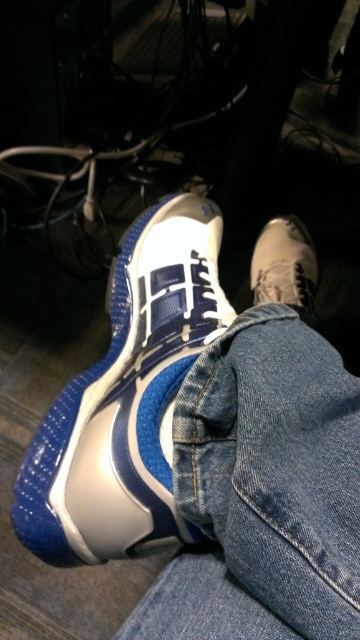
Looking at this image, is denim at lower left below blue rubber sneaker at lower left?

Yes.

Is denim at lower left wider than blue rubber sneaker at lower left?

No, denim at lower left is not wider than blue rubber sneaker at lower left.

Does point (345, 636) come in front of point (87, 403)?

Yes, point (345, 636) is in front of point (87, 403).

What are the coordinates of `denim at lower left` in the screenshot? It's located at tap(263, 490).

Does blue rubber sneaker at lower left appear on the left side of leather sneaker at lower right?

Yes, blue rubber sneaker at lower left is to the left of leather sneaker at lower right.

Locate an element on the screen. blue rubber sneaker at lower left is located at coordinates (127, 400).

You are a GUI agent. You are given a task and a screenshot of the screen. Output one action in this format:
    pyautogui.click(x=<x>, y=<y>)
    Task: Click on the blue rubber sneaker at lower left
    This screenshot has height=640, width=360.
    Given the screenshot: What is the action you would take?
    pos(127,400)

Is denim at lower left wider than leather sneaker at lower right?

Yes.

Is denim at lower left positioned at the back of leather sneaker at lower right?

No, denim at lower left is closer to the viewer.

Measure the distance between point (204, 416) and camera.

Point (204, 416) and camera are 14.45 inches apart from each other.

Identify the location of denim at lower left. [263, 490].